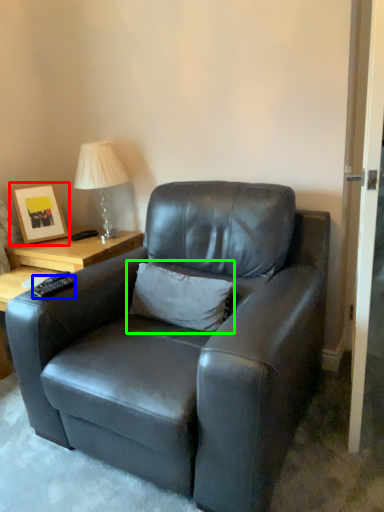
Question: Which object is the closest to the picture frame (highlighted by a red box)? Choose among these: remote (highlighted by a blue box) or pillow (highlighted by a green box).

Choices:
 (A) remote
 (B) pillow

Answer: (A)